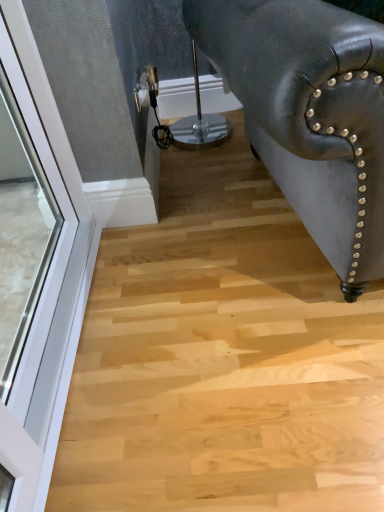
In order to click on matte black leather armchair at right in this screenshot , I will do `click(310, 114)`.

What is the approximate width of matte black leather armchair at right?

3.37 feet.

Describe the element at coordinates (310, 114) in the screenshot. I see `matte black leather armchair at right` at that location.

What do you see at coordinates (36, 280) in the screenshot? I see `white glass window at left` at bounding box center [36, 280].

The image size is (384, 512). Identify the location of white glass window at left. (36, 280).

You are a GUI agent. You are given a task and a screenshot of the screen. Output one action in this format:
    pyautogui.click(x=<x>, y=<y>)
    Task: Click on the matte black leather armchair at right
    This screenshot has width=384, height=512.
    Given the screenshot: What is the action you would take?
    pyautogui.click(x=310, y=114)

Based on their positions, is white glass window at left located to the left or right of matte black leather armchair at right?

Based on their positions, white glass window at left is located to the left of matte black leather armchair at right.

Which is behind, white glass window at left or matte black leather armchair at right?

white glass window at left.

Does point (68, 308) come in front of point (246, 85)?

That is False.

From the image's perspective, relative to matte black leather armchair at right, is white glass window at left above or below?

white glass window at left is below matte black leather armchair at right.

From a real-world perspective, which object rests below the other?

white glass window at left, from a real-world perspective.

Is white glass window at left thinner than matte black leather armchair at right?

Correct, the width of white glass window at left is less than that of matte black leather armchair at right.

Which of these two, white glass window at left or matte black leather armchair at right, stands shorter?

white glass window at left.

Is white glass window at left smaller than matte black leather armchair at right?

Yes.

Which is correct: white glass window at left is inside matte black leather armchair at right, or outside of it?

white glass window at left exists outside the volume of matte black leather armchair at right.

Is white glass window at left positioned far away from matte black leather armchair at right?

No, white glass window at left is not far from matte black leather armchair at right.

Could you tell me if white glass window at left is turned towards matte black leather armchair at right?

Yes, white glass window at left is turned towards matte black leather armchair at right.

Can you tell me how much white glass window at left and matte black leather armchair at right differ in facing direction?

There is a 79.9-degree angle between the facing directions of white glass window at left and matte black leather armchair at right.

Find the location of a particular element. This screenshot has height=512, width=384. window that is below the matte black leather armchair at right (from the image's perspective) is located at coordinates (36, 280).

In the scene shown: Considering the relative positions of matte black leather armchair at right and white glass window at left in the image provided, is matte black leather armchair at right to the right of white glass window at left from the viewer's perspective?

Indeed, matte black leather armchair at right is positioned on the right side of white glass window at left.

Is matte black leather armchair at right behind white glass window at left?

No.

Does point (363, 244) appear closer or farther from the camera than point (36, 110)?

Point (363, 244) appears to be closer to the viewer than point (36, 110).

From the image's perspective, which object appears higher, matte black leather armchair at right or white glass window at left?

matte black leather armchair at right, from the image's perspective.

From a real-world perspective, is matte black leather armchair at right on top of white glass window at left?

Yes.

Is matte black leather armchair at right wider than white glass window at left?

Yes, matte black leather armchair at right is wider than white glass window at left.

Considering the relative sizes of matte black leather armchair at right and white glass window at left in the image provided, is matte black leather armchair at right taller than white glass window at left?

Indeed, matte black leather armchair at right has a greater height compared to white glass window at left.

Who is bigger, matte black leather armchair at right or white glass window at left?

Bigger between the two is matte black leather armchair at right.

Is matte black leather armchair at right spatially inside white glass window at left, or outside of it?

matte black leather armchair at right cannot be found inside white glass window at left.

Can you see matte black leather armchair at right touching white glass window at left?

They are not placed beside each other.

Is matte black leather armchair at right positioned with its back to white glass window at left?

matte black leather armchair at right does not have its back to white glass window at left.

In the scene shown: What's the angular difference between matte black leather armchair at right and white glass window at left's facing directions?

There is a 79.9-degree angle between the facing directions of matte black leather armchair at right and white glass window at left.

Locate an element on the screen. furniture on the right side of white glass window at left is located at coordinates (x=310, y=114).

Image resolution: width=384 pixels, height=512 pixels. I want to click on window directly beneath the matte black leather armchair at right (from a real-world perspective), so click(x=36, y=280).

Where is `furniture on the right of white glass window at left`? furniture on the right of white glass window at left is located at coordinates (310, 114).